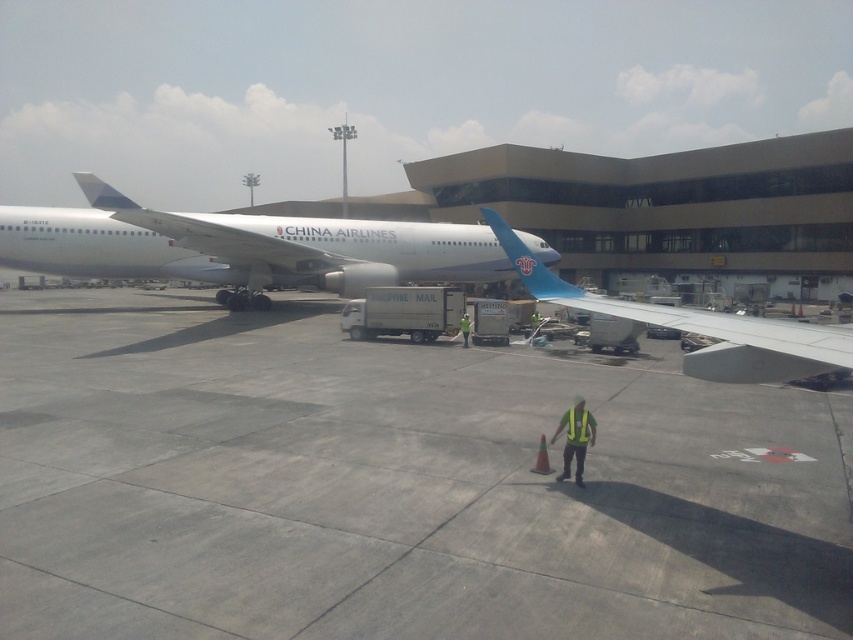
From the picture: Does white glossy airplane at center appear on the left side of blue glossy wing at center?

Indeed, white glossy airplane at center is positioned on the left side of blue glossy wing at center.

Does white glossy airplane at center have a lesser height compared to blue glossy wing at center?

No, white glossy airplane at center is not shorter than blue glossy wing at center.

You are a GUI agent. You are given a task and a screenshot of the screen. Output one action in this format:
    pyautogui.click(x=<x>, y=<y>)
    Task: Click on the white glossy airplane at center
    This screenshot has height=640, width=853.
    Given the screenshot: What is the action you would take?
    pyautogui.click(x=316, y=244)

The width and height of the screenshot is (853, 640). What are the coordinates of `white glossy airplane at center` in the screenshot? It's located at (316, 244).

Does yellow reflective vest at center come in front of yellow reflective safety vest at center?

No, yellow reflective vest at center is behind yellow reflective safety vest at center.

Between yellow reflective vest at center and yellow reflective safety vest at center, which one is positioned lower?

yellow reflective vest at center is lower down.

Who is more distant from viewer, (575, 481) or (579, 436)?

The point (575, 481) is behind.

Identify the location of yellow reflective vest at center. (575, 438).

Who is more forward, (575, 465) or (468, 330)?

Point (575, 465) is in front.

Which is below, yellow reflective vest at center or green reflective vest at center?

Positioned lower is yellow reflective vest at center.

What do you see at coordinates (575, 438) in the screenshot? The height and width of the screenshot is (640, 853). I see `yellow reflective vest at center` at bounding box center [575, 438].

Identify the location of yellow reflective vest at center. (575, 438).